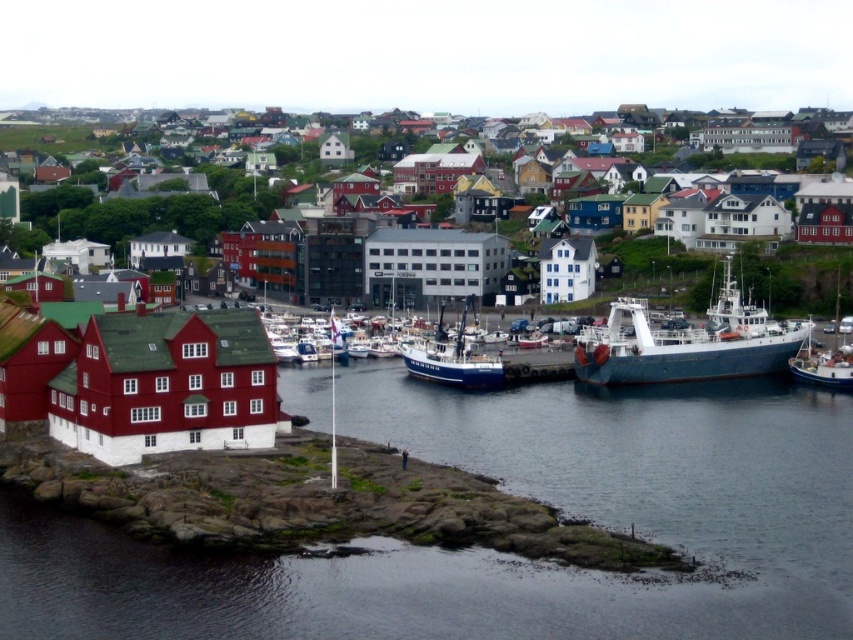
Consider the image. Is matte red building at center taller than blue matte boat at center?

Correct, matte red building at center is much taller as blue matte boat at center.

Can you confirm if matte red building at center is smaller than blue matte boat at center?

No.

Which is behind, point (306, 285) or point (492, 381)?

Positioned behind is point (306, 285).

Image resolution: width=853 pixels, height=640 pixels. What are the coordinates of `matte red building at center` in the screenshot? It's located at (799, 284).

Is point (585, 337) in front of point (822, 365)?

No, (585, 337) is further to viewer.

How much distance is there between blue metallic ship at lower right and blue metallic boat at right?

blue metallic ship at lower right and blue metallic boat at right are 35.04 feet apart.

I want to click on blue metallic ship at lower right, so click(686, 342).

Is point (734, 300) positioned behind point (461, 340)?

No, it is in front of (461, 340).

Does blue metallic ship at lower right appear under blue matte boat at center?

Incorrect, blue metallic ship at lower right is not positioned below blue matte boat at center.

Describe the element at coordinates (686, 342) in the screenshot. The image size is (853, 640). I see `blue metallic ship at lower right` at that location.

The width and height of the screenshot is (853, 640). I want to click on blue metallic ship at lower right, so click(x=686, y=342).